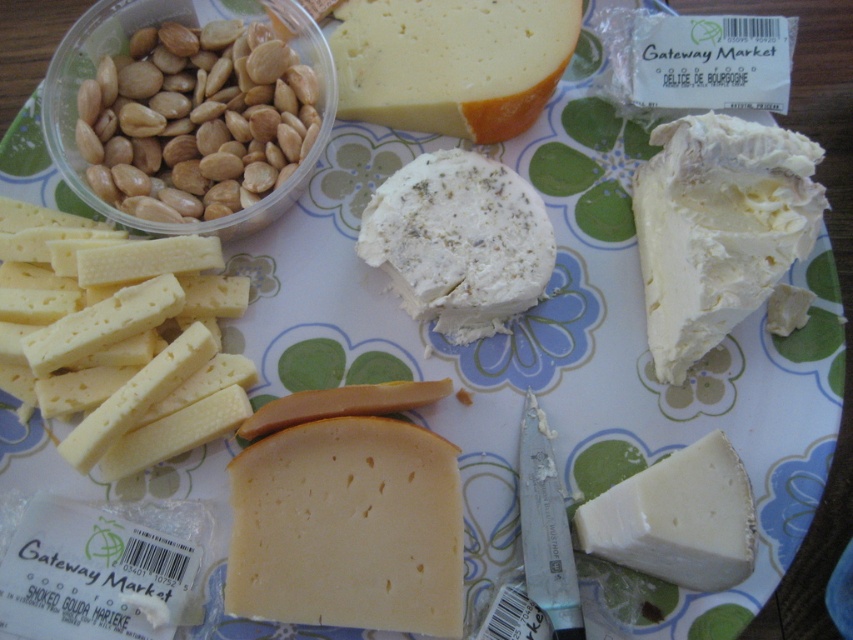
Question: Considering the relative positions of yellow crumbly cheese at lower left and white crumbly cream cheese at center in the image provided, where is yellow crumbly cheese at lower left located with respect to white crumbly cream cheese at center?

Choices:
 (A) right
 (B) left

Answer: (B)

Question: Which of these objects is positioned farthest from the yellow crumbly cheese at lower left?

Choices:
 (A) white creamy cheese at lower right
 (B) brown matte almonds at left
 (C) white creamy cheese at upper right

Answer: (C)

Question: Based on their relative distances, which object is farther from the brown matte almonds at left?

Choices:
 (A) white crumbly cream cheese at center
 (B) white creamy cheese at lower right
 (C) white creamy cheese at upper right

Answer: (B)

Question: Does yellow crumbly cheese at lower left lie in front of brown matte almonds at left?

Choices:
 (A) yes
 (B) no

Answer: (A)

Question: Which object is the farthest from the white creamy cheese at lower right?

Choices:
 (A) white crumbly cream cheese at center
 (B) yellowish-white creamy cheese at upper center

Answer: (B)

Question: Is yellow crumbly cheese at lower left to the right of white crumbly cream cheese at center from the viewer's perspective?

Choices:
 (A) yes
 (B) no

Answer: (B)